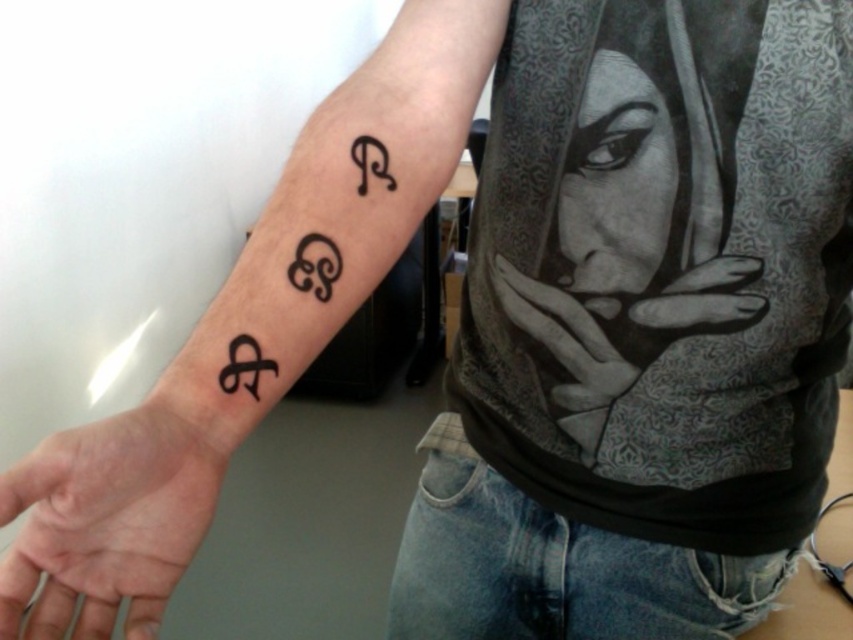
Can you confirm if black ink tattoo at center is positioned to the right of black ink symbol at lower left?

Correct, you'll find black ink tattoo at center to the right of black ink symbol at lower left.

Is black ink tattoo at center shorter than black ink symbol at lower left?

In fact, black ink tattoo at center may be taller than black ink symbol at lower left.

You are a GUI agent. You are given a task and a screenshot of the screen. Output one action in this format:
    pyautogui.click(x=<x>, y=<y>)
    Task: Click on the black ink tattoo at center
    This screenshot has height=640, width=853.
    Given the screenshot: What is the action you would take?
    pyautogui.click(x=315, y=266)

Is point (73, 589) positioned after point (322, 276)?

No, (73, 589) is closer to viewer.

Between point (102, 497) and point (305, 237), which one is positioned behind?

The point (305, 237) is more distant.

The height and width of the screenshot is (640, 853). In order to click on smooth skin palm at lower left in this screenshot , I will do `click(112, 516)`.

Is the position of black ink tattoo at upper right less distant than that of black ink symbol at lower left?

Yes, it is in front of black ink symbol at lower left.

Between black ink tattoo at upper right and black ink symbol at lower left, which one has more height?

black ink tattoo at upper right is taller.

Where is `black ink tattoo at upper right`? Image resolution: width=853 pixels, height=640 pixels. black ink tattoo at upper right is located at coordinates (242, 332).